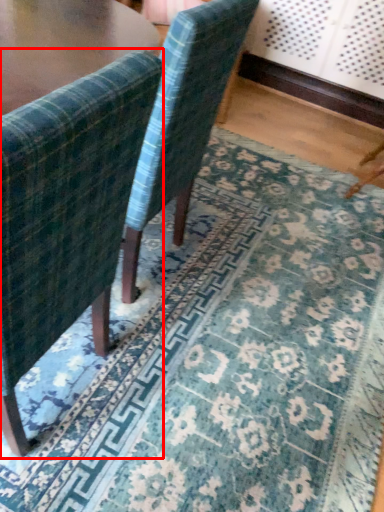
Question: In this image, where is chair (annotated by the red box) located relative to chair?

Choices:
 (A) right
 (B) left

Answer: (B)